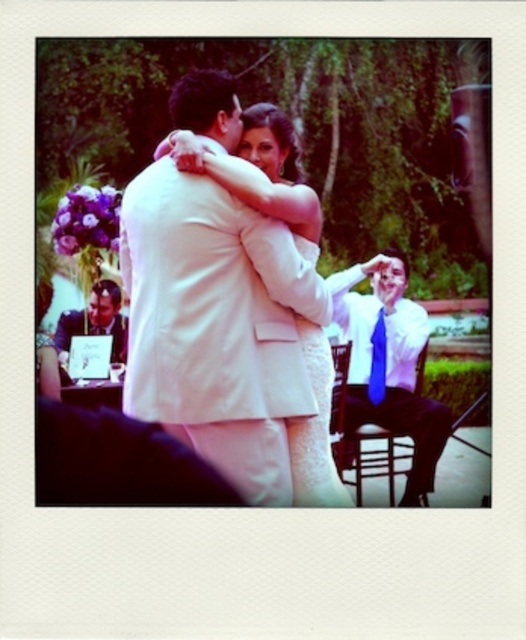
Question: Which point is closer to the camera?

Choices:
 (A) matte white suit at left
 (B) blue silk tie at right

Answer: (B)

Question: Among these points, which one is nearest to the camera?

Choices:
 (A) (369, 381)
 (B) (106, 317)

Answer: (A)

Question: Does white satin dress at center appear over blue satin tie at right?

Choices:
 (A) yes
 (B) no

Answer: (A)

Question: Is white satin dress at center above white textured dress at center?

Choices:
 (A) no
 (B) yes

Answer: (B)

Question: Which of the following is the farthest from the observer?

Choices:
 (A) (99, 282)
 (B) (326, 339)

Answer: (A)

Question: Considering the relative positions of white satin dress at center and blue satin tie at right in the image provided, where is white satin dress at center located with respect to blue satin tie at right?

Choices:
 (A) above
 (B) below

Answer: (A)